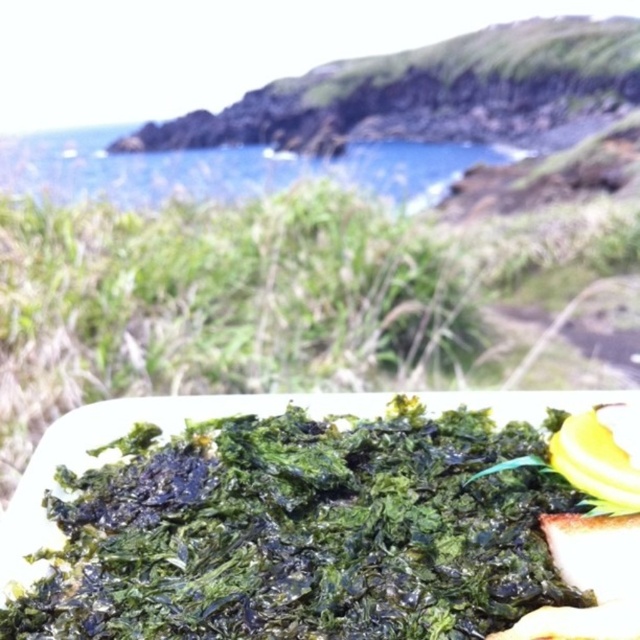
Measure the distance between green crispy seaweed at bottom and camera.

A distance of 32.21 inches exists between green crispy seaweed at bottom and camera.

This screenshot has width=640, height=640. What do you see at coordinates (324, 536) in the screenshot?
I see `green crispy seaweed at bottom` at bounding box center [324, 536].

Is point (220, 522) in front of point (99, 150)?

Yes, point (220, 522) is closer to viewer.

Image resolution: width=640 pixels, height=640 pixels. Identify the location of green crispy seaweed at bottom. (324, 536).